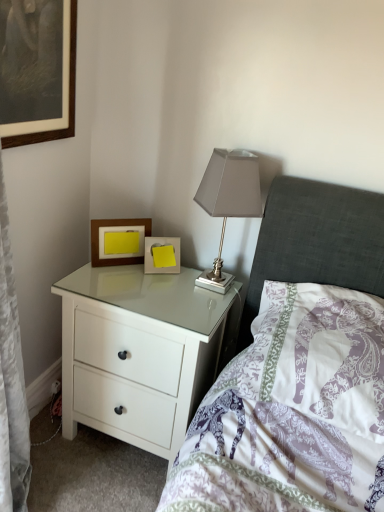
Locate an element on the screen. Image resolution: width=384 pixels, height=512 pixels. free space to the left of yellow paper at center, the 3th picture frame positioned from the top is located at coordinates (115, 274).